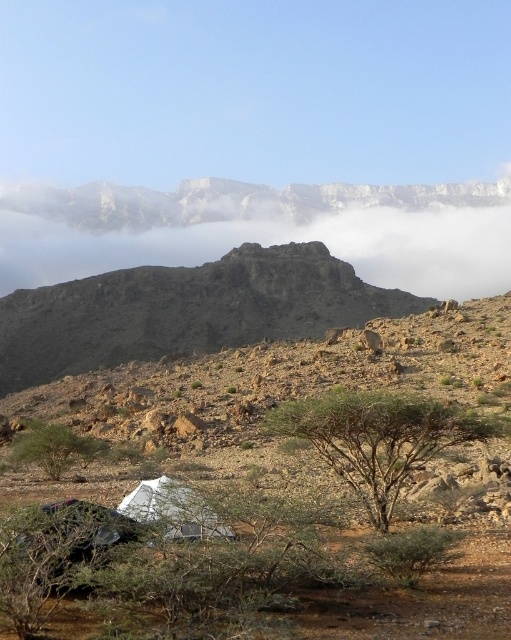
Does white foggy cloud at upper center appear over green leafy tree at lower left?

Correct, white foggy cloud at upper center is located above green leafy tree at lower left.

Is point (388, 257) more distant than point (18, 452)?

Yes, it is.

Find the location of a particular element. Image resolution: width=511 pixels, height=640 pixels. white foggy cloud at upper center is located at coordinates (262, 228).

Looking at this image, does white foggy cloud at upper center appear on the right side of green leafy tree at center?

Incorrect, white foggy cloud at upper center is not on the right side of green leafy tree at center.

This screenshot has height=640, width=511. What do you see at coordinates (262, 228) in the screenshot? I see `white foggy cloud at upper center` at bounding box center [262, 228].

At what (x,y) coordinates should I click in order to perform the action: click on white foggy cloud at upper center. Please return your answer as a coordinate pair (x, y). Looking at the image, I should click on (262, 228).

Is rugged stone mountain at center shorter than green leafy tree at center?

Incorrect, rugged stone mountain at center's height does not fall short of green leafy tree at center's.

Where is `rugged stone mountain at center`? rugged stone mountain at center is located at coordinates (185, 310).

Where is `rugged stone mountain at center`? Image resolution: width=511 pixels, height=640 pixels. rugged stone mountain at center is located at coordinates (185, 310).